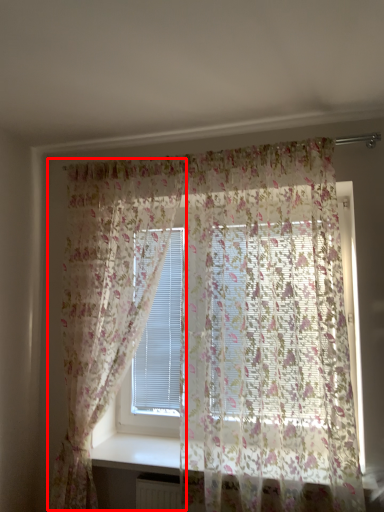
Question: From the image's perspective, where is curtain (annotated by the red box) located in relation to curtain in the image?

Choices:
 (A) below
 (B) above

Answer: (A)